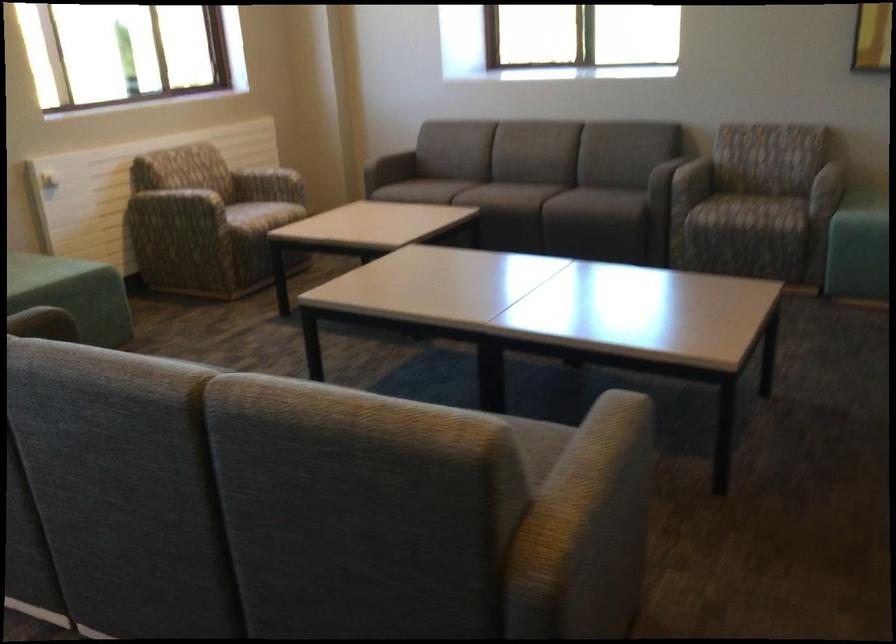
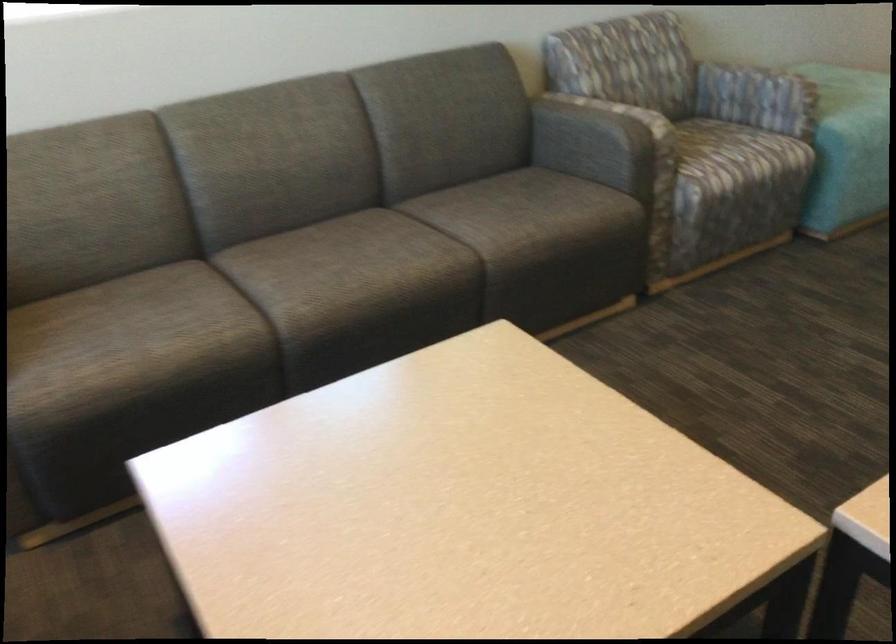
Question: I am providing you with two images of the same scene from different viewpoints. After the viewpoint changes to image2, which objects are now occluded?

Choices:
 (A) teal chair sitting surface
 (B) sofa armrest
 (C) grey sofa sitting surface
 (D) black ping pong paddle

Answer: (B)